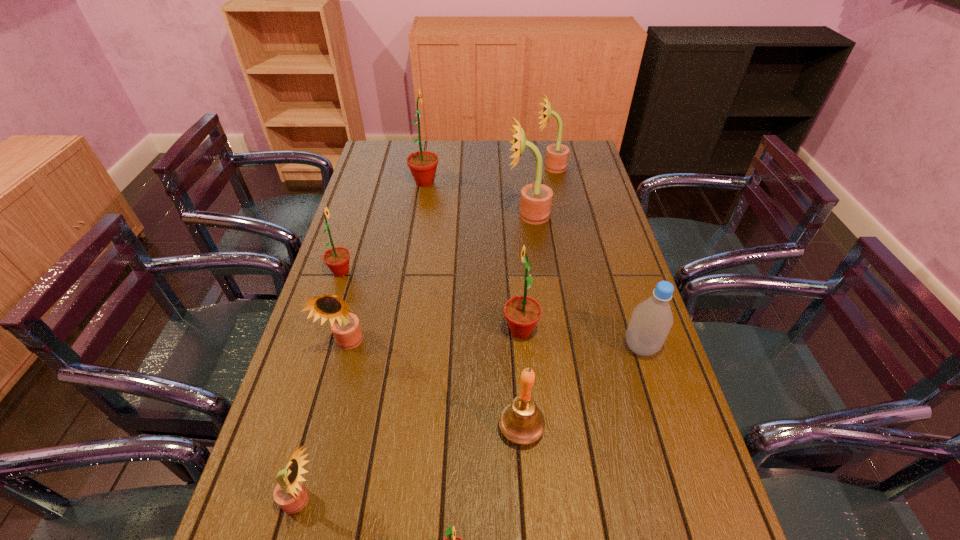
Identify which yellow sunflower is the second nearest to the third farthest yellow sunflower. Please provide its 2D coordinates. Your answer should be formatted as a tuple, i.e. [(x, y)], where the tuple contains the x and y coordinates of a point satisfying the conditions above.

[(536, 199)]

The width and height of the screenshot is (960, 540). What are the coordinates of `yellow sunflower that is the fourth closest to the smallest green sunflower` in the screenshot? It's located at (557, 154).

Where is `green sunflower that is the second closest to the gray bottle`? The height and width of the screenshot is (540, 960). green sunflower that is the second closest to the gray bottle is located at coordinates (451, 539).

Locate an element on the screen. The image size is (960, 540). green sunflower that can be found as the closest to the second smallest yellow sunflower is located at coordinates (337, 259).

At what (x,y) coordinates should I click in order to perform the action: click on free space that satisfies the following two spatial constraints: 1. on the face of the bottle; 2. on the right side of the fourth sunflower from left to right. Please return your answer as a coordinate pair (x, y). Looking at the image, I should click on (398, 347).

I want to click on free space that satisfies the following two spatial constraints: 1. on the face of the bottle; 2. on the left side of the fourth farthest sunflower, so click(318, 347).